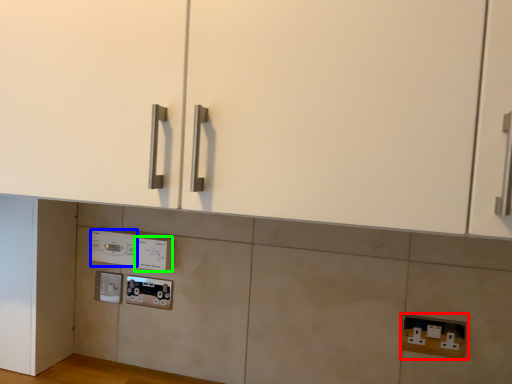
Question: Considering the real-world distances, which object is closest to electric outlet (highlighted by a red box)? appliance (highlighted by a blue box) or electric outlet (highlighted by a green box).

Choices:
 (A) appliance
 (B) electric outlet

Answer: (B)